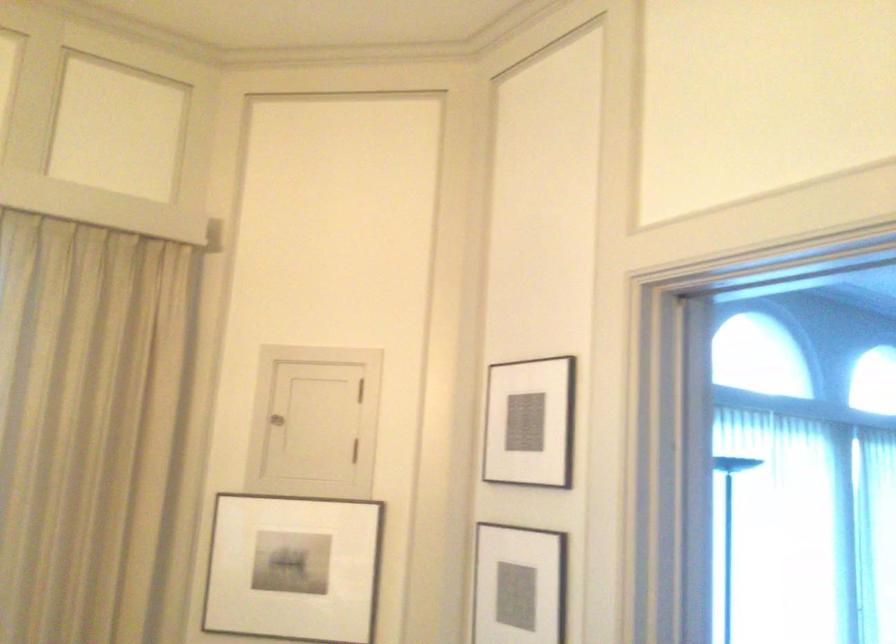
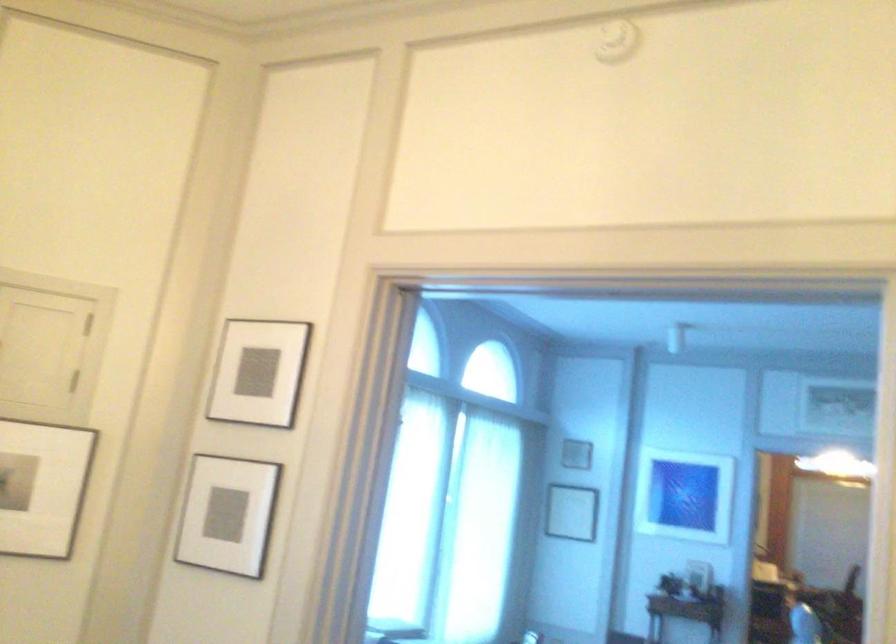
Question: How did the camera likely rotate?

Choices:
 (A) Left
 (B) Right
 (C) Up
 (D) Down

Answer: (B)